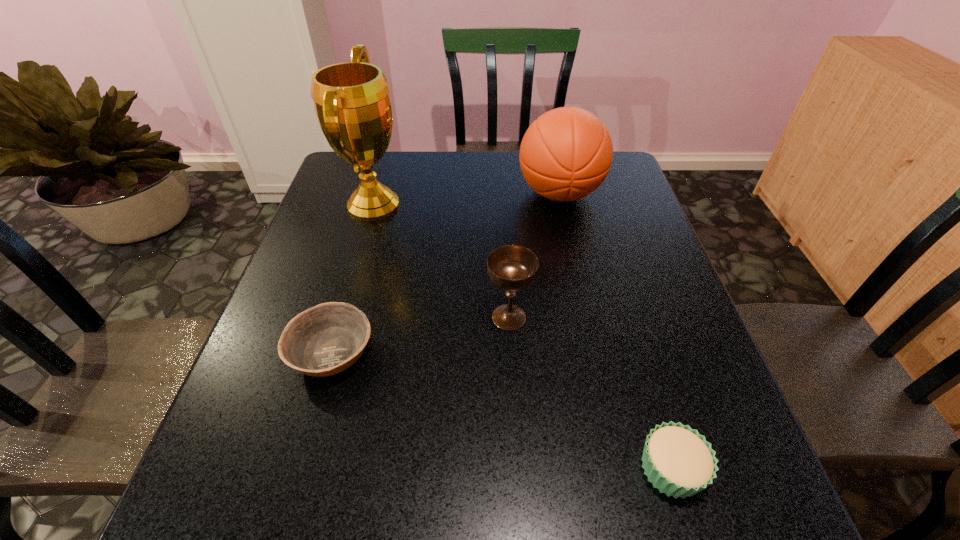
I want to click on the tallest object, so click(352, 103).

At what (x,y) coordinates should I click in order to perform the action: click on basketball. Please return your answer as a coordinate pair (x, y). Looking at the image, I should click on (566, 154).

Locate an element on the screen. This screenshot has width=960, height=540. the third shortest object is located at coordinates (512, 268).

This screenshot has width=960, height=540. What are the coordinates of `bowl` in the screenshot? It's located at (x=324, y=340).

Where is `the nearest object`? the nearest object is located at coordinates (678, 461).

The width and height of the screenshot is (960, 540). Identify the location of vacant space situated on the front-facing side of the tallest object. (437, 205).

You are a GUI agent. You are given a task and a screenshot of the screen. Output one action in this format:
    pyautogui.click(x=<x>, y=<y>)
    Task: Click on the vacant region located on the front of the basketball
    This screenshot has height=540, width=960.
    Given the screenshot: What is the action you would take?
    pyautogui.click(x=580, y=285)

You are a GUI agent. You are given a task and a screenshot of the screen. Output one action in this format:
    pyautogui.click(x=<x>, y=<y>)
    Task: Click on the free space located on the left of the third shortest object
    The image size is (960, 540).
    Given the screenshot: What is the action you would take?
    pyautogui.click(x=341, y=317)

What are the coordinates of `free space located 0.240m on the front of the bowl` in the screenshot? It's located at (282, 530).

The height and width of the screenshot is (540, 960). I want to click on vacant space located on the back of the nearest object, so click(639, 364).